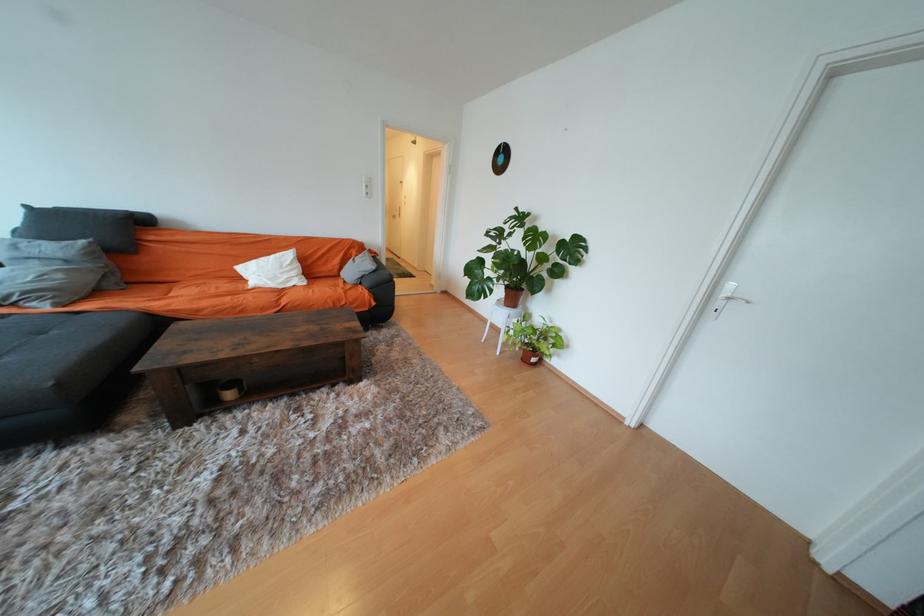
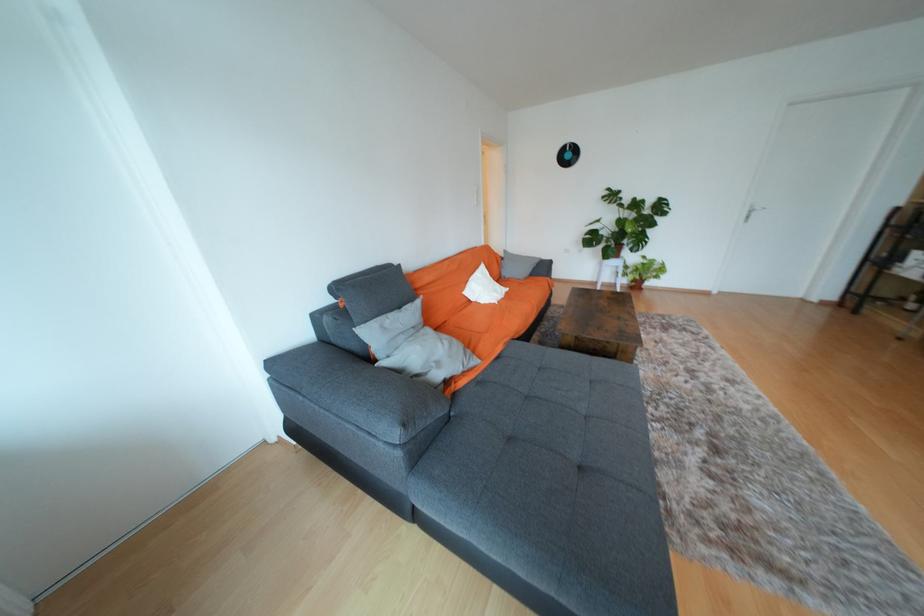
In the second image, find the point that corresponds to point 506,161 in the first image.

(574, 156)